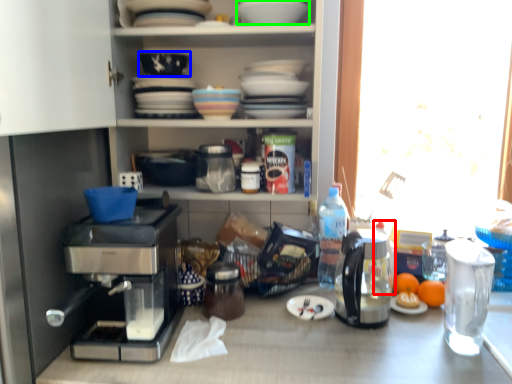
Question: Estimate the real-world distances between objects in this image. Which object is closer to bottle (highlighted by a red box), bowl (highlighted by a blue box) or tableware (highlighted by a green box)?

Choices:
 (A) bowl
 (B) tableware

Answer: (B)